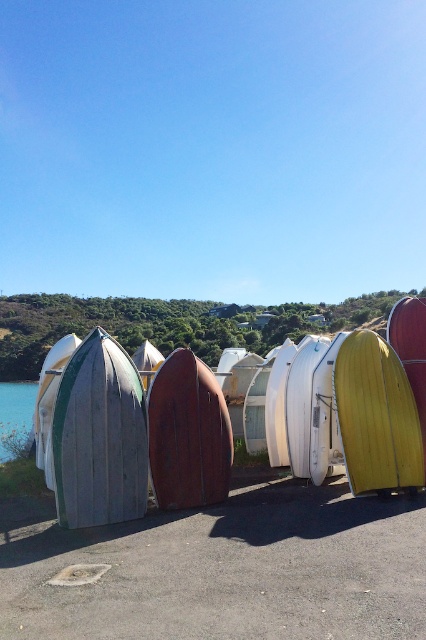
From the picture: Can you confirm if yellow matte surfboard at center is positioned to the right of transparent glass water at lower left?

Yes, yellow matte surfboard at center is to the right of transparent glass water at lower left.

What do you see at coordinates (376, 417) in the screenshot?
I see `yellow matte surfboard at center` at bounding box center [376, 417].

Is point (394, 365) positioned in front of point (14, 448)?

Yes, point (394, 365) is in front of point (14, 448).

Locate an element on the screen. The height and width of the screenshot is (640, 426). yellow matte surfboard at center is located at coordinates (376, 417).

Between point (103, 483) and point (347, 420), which one is positioned behind?

The point (347, 420) is more distant.

Is wooden surfboard at left to the right of yellow matte surfboard at center from the viewer's perspective?

No, wooden surfboard at left is not to the right of yellow matte surfboard at center.

What are the coordinates of `wooden surfboard at left` in the screenshot? It's located at (98, 436).

At what (x,y) coordinates should I click in order to perform the action: click on wooden surfboard at left. Please return your answer as a coordinate pair (x, y). This screenshot has height=640, width=426. Looking at the image, I should click on pos(98,436).

Which is more to the right, wooden surfboard at left or white matte surfboard at left?

wooden surfboard at left

Who is taller, wooden surfboard at left or white matte surfboard at left?

Standing taller between the two is white matte surfboard at left.

Is point (146, 410) positioned after point (66, 348)?

No, (146, 410) is closer to viewer.

This screenshot has height=640, width=426. In order to click on wooden surfboard at left in this screenshot , I will do pos(98,436).